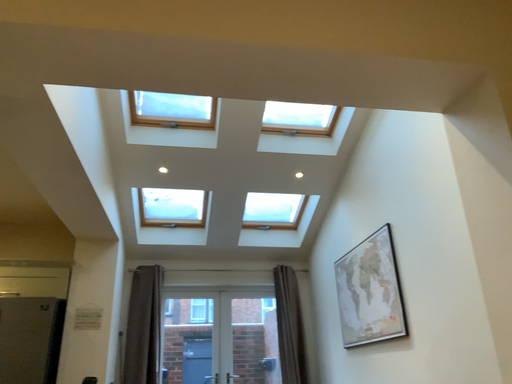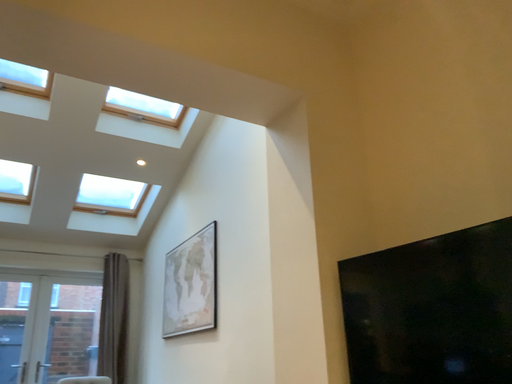
Question: How did the camera likely rotate when shooting the video?

Choices:
 (A) rotated left
 (B) rotated right

Answer: (B)